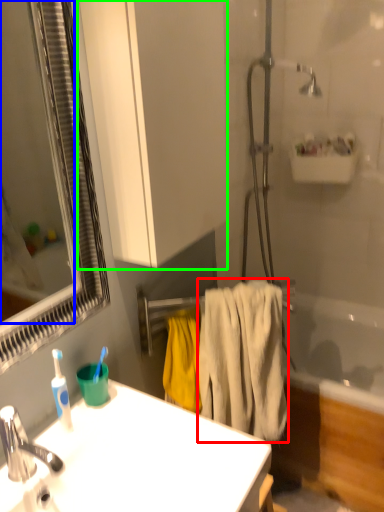
Question: Which object is the closest to the bath towel (highlighted by a red box)? Choose among these: mirror (highlighted by a blue box) or bathroom cabinet (highlighted by a green box).

Choices:
 (A) mirror
 (B) bathroom cabinet

Answer: (B)